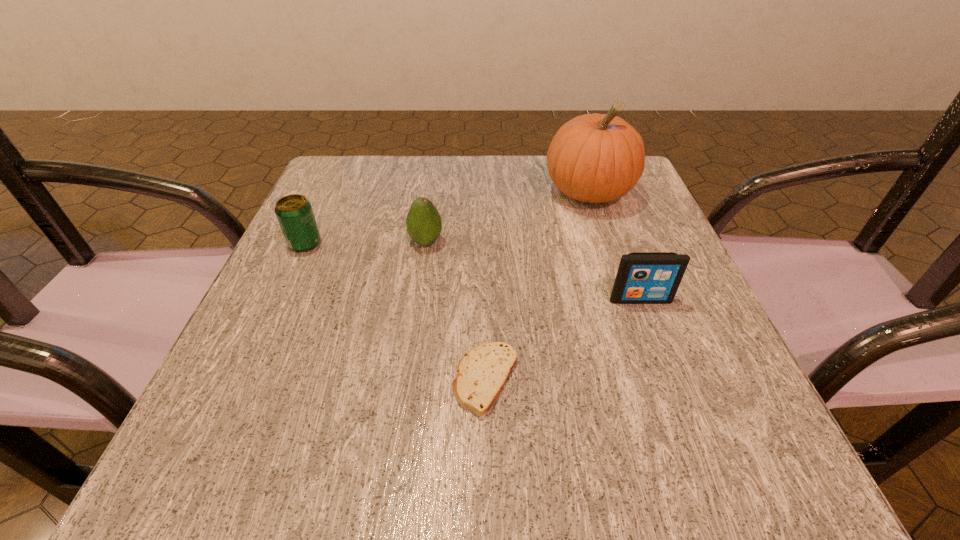
Find the location of `vacant space located on the front of the beer can`. vacant space located on the front of the beer can is located at coordinates (218, 430).

Find the location of `free space located on the left of the nearest object`. free space located on the left of the nearest object is located at coordinates click(x=306, y=380).

I want to click on object positioned at the far edge, so coord(594,158).

The height and width of the screenshot is (540, 960). I want to click on object situated at the left edge, so click(294, 212).

Identify the location of pumpkin present at the right edge. Image resolution: width=960 pixels, height=540 pixels. (594, 158).

Identify the location of iPod present at the right edge. (643, 277).

Image resolution: width=960 pixels, height=540 pixels. What are the coordinates of `object present at the far right corner` in the screenshot? It's located at (594, 158).

In the image, there is a desktop. Find the location of `vacant space at the far edge`. vacant space at the far edge is located at coordinates (470, 207).

This screenshot has height=540, width=960. Identify the location of free space at the left edge of the desktop. (264, 295).

Find the location of a particular element. free space at the right edge of the desktop is located at coordinates (686, 273).